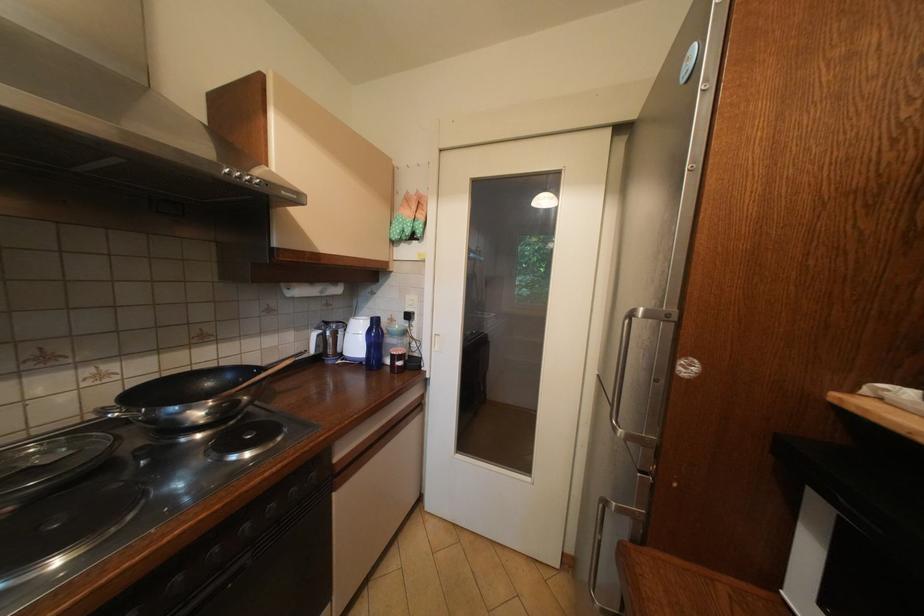
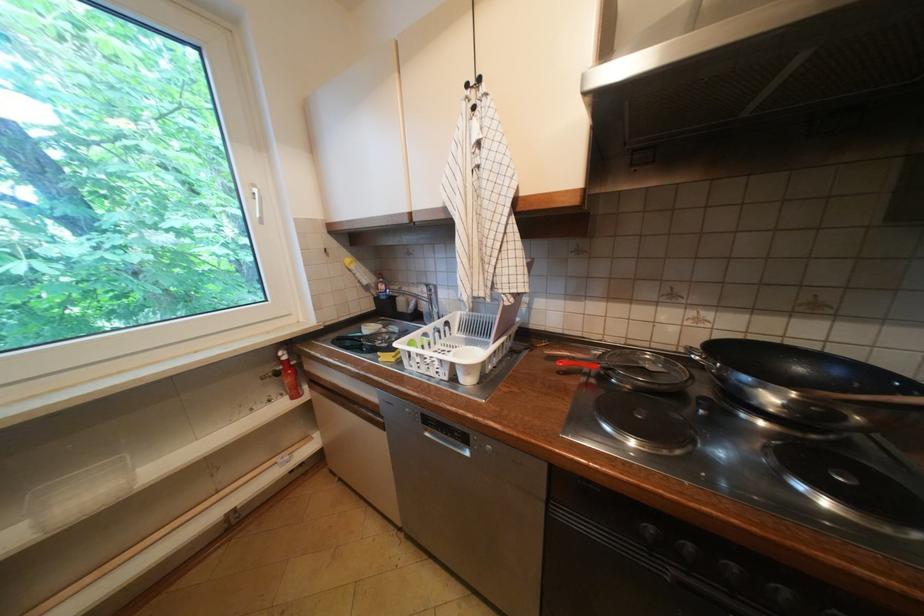
Question: The camera is either moving clockwise (left) or counter-clockwise (right) around the object. The first image is from the beginning of the video and the second image is from the end. Is the camera moving left or right when shooting the video?

Choices:
 (A) Left
 (B) Right

Answer: (B)